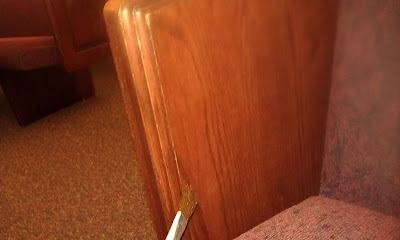
At what (x,y) coordinates should I click in order to perform the action: click on wooden panel. Please return your answer as a coordinate pair (x, y). This screenshot has height=240, width=400. Looking at the image, I should click on (374, 114), (90, 21).